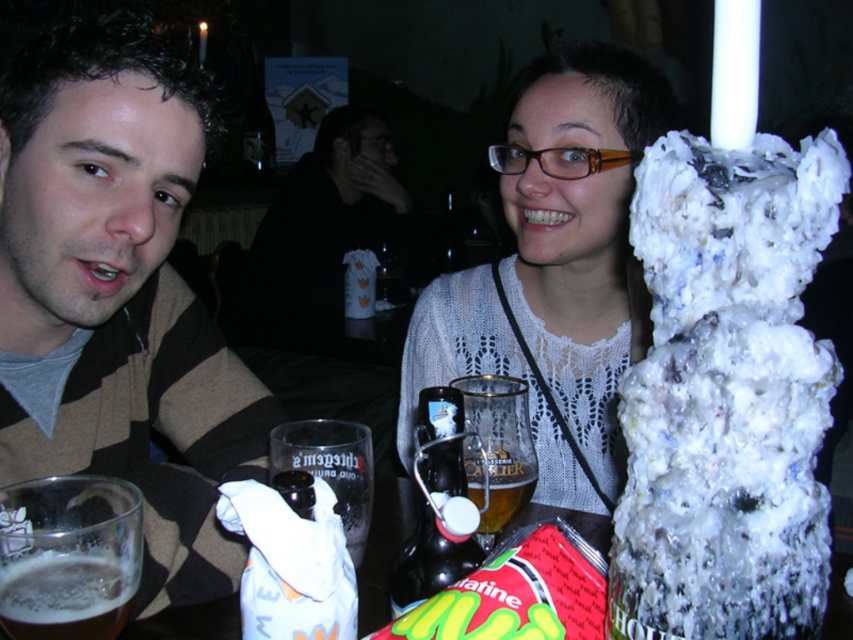
Question: Which point is closer to the camera?

Choices:
 (A) coord(108,582)
 (B) coord(801,408)

Answer: (B)

Question: Does white fluffy cake at right have a greater width compared to white knitted sweater at upper center?

Choices:
 (A) no
 (B) yes

Answer: (A)

Question: Is white fluffy cake at right to the right of foamy white beer at lower left from the viewer's perspective?

Choices:
 (A) no
 (B) yes

Answer: (B)

Question: Estimate the real-world distances between objects in this image. Which object is farther from the foamy white beer at lower left?

Choices:
 (A) white knitted sweater at upper center
 (B) striped sweater at left
 (C) white fluffy cake at right

Answer: (A)

Question: Can you confirm if striped sweater at left is wider than white fluffy cake at right?

Choices:
 (A) no
 (B) yes

Answer: (B)

Question: Which of these objects is positioned closest to the white fluffy cake at right?

Choices:
 (A) striped sweater at left
 (B) white knitted sweater at upper center

Answer: (A)